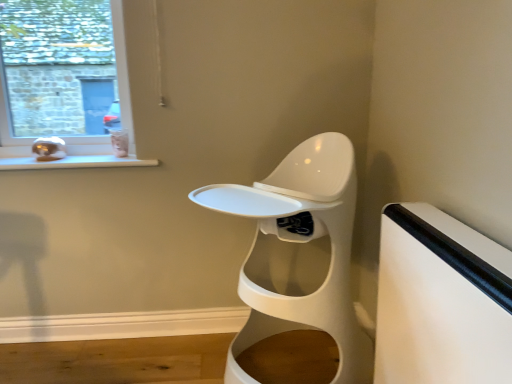
Locate an element on the screen. Image resolution: width=512 pixels, height=384 pixels. vacant region above white glossy window sill at lower left (from a real-world perspective) is located at coordinates (56, 161).